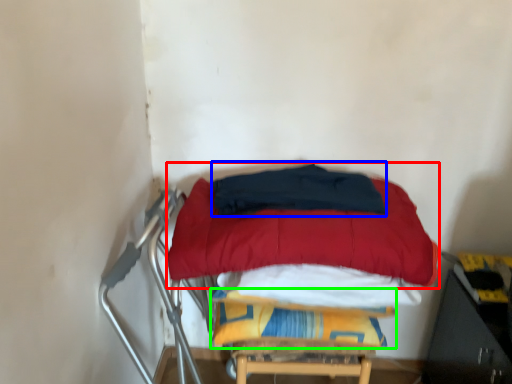
Question: Considering the real-world distances, which object is farthest from mattress (highlighted by a red box)? blanket (highlighted by a blue box) or blanket (highlighted by a green box)?

Choices:
 (A) blanket
 (B) blanket

Answer: (B)